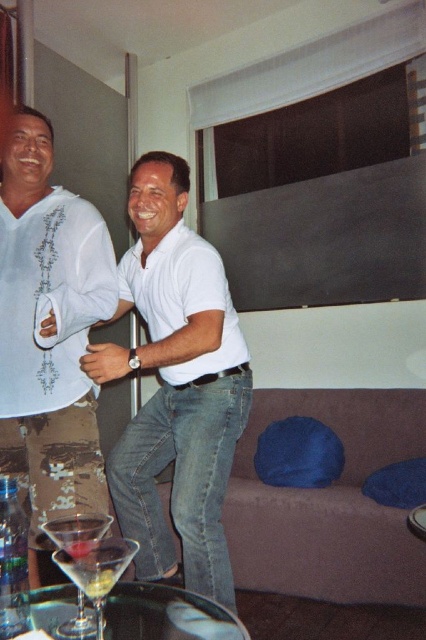
You are a photographer trying to capture a candid shot of both the white embroidered shirt at left and the white matte shirt at center. Since you want to ensure both are in focus, you need to know their vertical alignment. Which shirt is lower in the frame?

The white matte shirt at center is positioned under the white embroidered shirt at left, so the white matte shirt at center is lower in the frame.

You are standing in the room and want to reach the point at coordinates point (x=204, y=636). You have a 1.2 meter long stick. If you extend the stick towards the point, will it reach?

The distance between the viewer and point (x=204, y=636) is 1.22 meters. Since the stick is only 1.2 meters long, it will be 0.02 meters short of reaching the point.